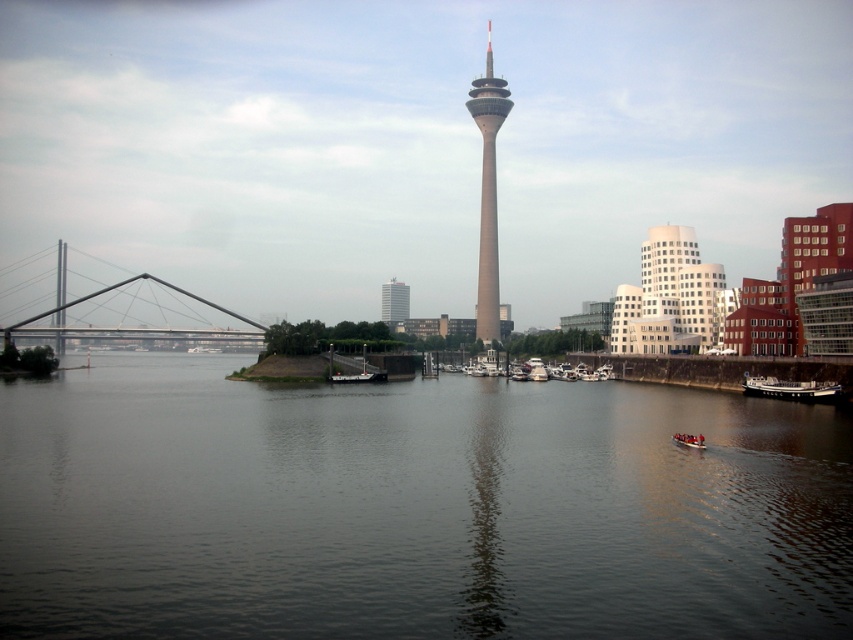
Question: Which object is closer to the camera taking this photo?

Choices:
 (A) white glossy boats at center
 (B) metallic silver boat at lower right
 (C) wooden boat at center
 (D) light gray concrete tower at center

Answer: (B)

Question: Estimate the real-world distances between objects in this image. Which object is closer to the light gray concrete tower at center?

Choices:
 (A) black matte boat at center
 (B) dark gray metallic boat at lower right
 (C) wooden boat at center
 (D) dark water at center

Answer: (A)

Question: Does light gray concrete tower at center come in front of metallic silver boat at lower right?

Choices:
 (A) yes
 (B) no

Answer: (B)

Question: Which point is closer to the camera?

Choices:
 (A) dark gray metallic boat at lower right
 (B) metallic silver boat at lower right
 (C) light gray concrete tower at center

Answer: (B)

Question: Does smooth concrete tower at center appear on the right side of metallic gray bridge at left?

Choices:
 (A) no
 (B) yes

Answer: (B)

Question: Can you confirm if light gray concrete tower at center is wider than black matte boat at center?

Choices:
 (A) no
 (B) yes

Answer: (B)